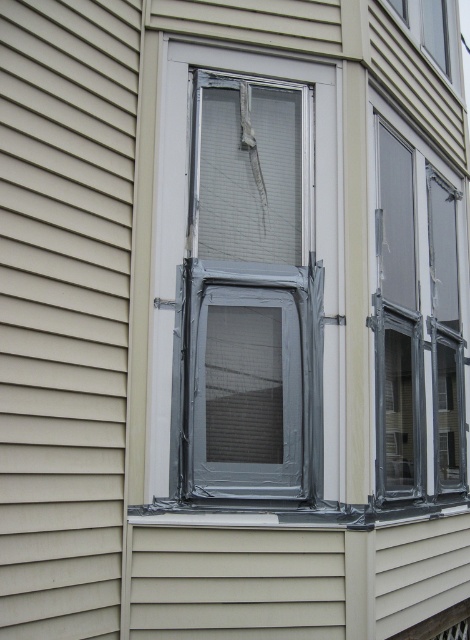
You are a window installer assessing the building exterior. You notice the metallic silver window frame at center and the clear plastic window at center. Which one is positioned higher in relation to the other?

The metallic silver window frame at center is positioned higher than the clear plastic window at center.

You are standing in front of the building and notice the metallic silver window frame at center. Can you determine its exact position using the coordinate system provided?

The metallic silver window frame at center is located at point (x=247, y=282) in the coordinate system.

Based on the photo, you are an inspector checking the building exterior. You notice the metallic silver window frame at center and the beige siding at center. Which one has a shorter height?

The metallic silver window frame at center is not as tall as the beige siding at center, so the metallic silver window frame at center has a shorter height.